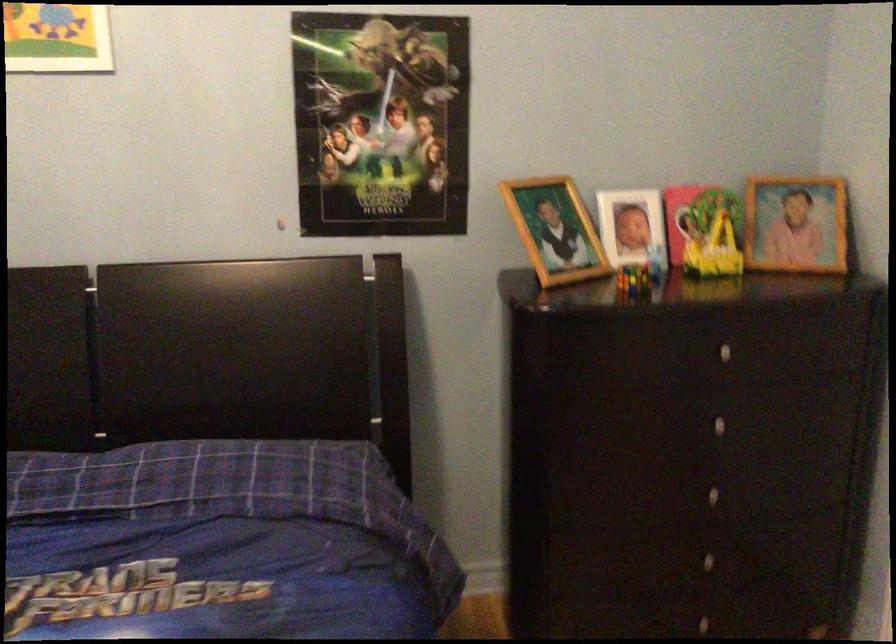
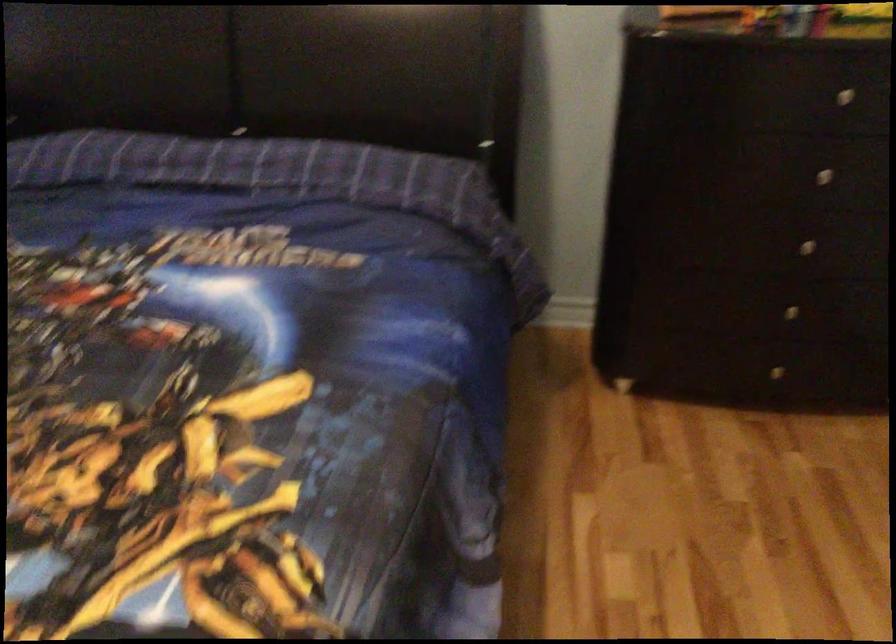
In the second image, find the point that corresponds to [716,556] in the first image.

(790, 310)